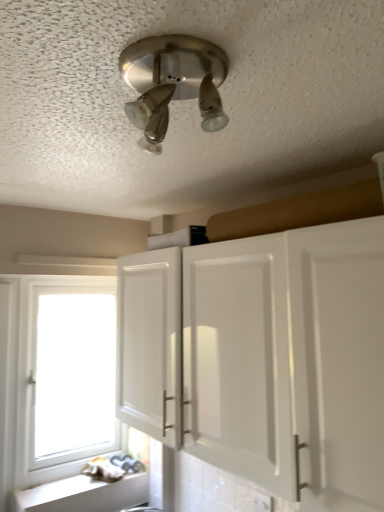
Question: Is white plastic electric outlet at lower center in contact with brushed metal light fixture at upper center?

Choices:
 (A) yes
 (B) no

Answer: (B)

Question: Is white plastic electric outlet at lower center aimed at brushed metal light fixture at upper center?

Choices:
 (A) yes
 (B) no

Answer: (B)

Question: Is white plastic electric outlet at lower center not near brushed metal light fixture at upper center?

Choices:
 (A) no
 (B) yes

Answer: (B)

Question: Can you confirm if white plastic electric outlet at lower center is shorter than brushed metal light fixture at upper center?

Choices:
 (A) yes
 (B) no

Answer: (A)

Question: From a real-world perspective, is white plastic electric outlet at lower center below brushed metal light fixture at upper center?

Choices:
 (A) yes
 (B) no

Answer: (A)

Question: From the image's perspective, is white plastic electric outlet at lower center on brushed metal light fixture at upper center?

Choices:
 (A) yes
 (B) no

Answer: (B)

Question: From a real-world perspective, is white glossy cabinet at center physically below white plastic electric outlet at lower center?

Choices:
 (A) yes
 (B) no

Answer: (B)

Question: Can you confirm if white glossy cabinet at center is thinner than white plastic electric outlet at lower center?

Choices:
 (A) no
 (B) yes

Answer: (A)

Question: Are white glossy cabinet at center and white plastic electric outlet at lower center located far from each other?

Choices:
 (A) yes
 (B) no

Answer: (B)

Question: Does white glossy cabinet at center have a larger size compared to white plastic electric outlet at lower center?

Choices:
 (A) no
 (B) yes

Answer: (B)

Question: Is white glossy cabinet at center facing towards white plastic electric outlet at lower center?

Choices:
 (A) no
 (B) yes

Answer: (A)

Question: From the image's perspective, is white glossy cabinet at center above white plastic electric outlet at lower center?

Choices:
 (A) no
 (B) yes

Answer: (B)

Question: Considering the relative sizes of white wood window at lower left and white glossy cabinet at center in the image provided, is white wood window at lower left taller than white glossy cabinet at center?

Choices:
 (A) yes
 (B) no

Answer: (A)